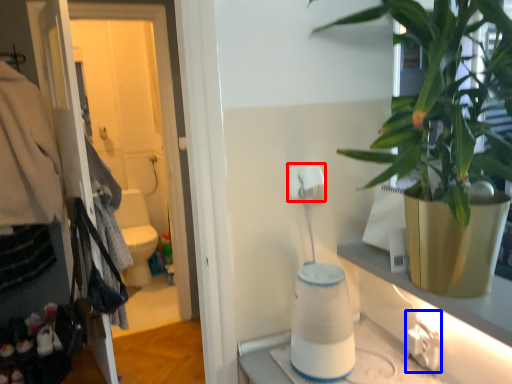
Question: Which object is closer to the camera taking this photo, toilet paper (highlighted by a red box) or electric outlet (highlighted by a blue box)?

Choices:
 (A) toilet paper
 (B) electric outlet

Answer: (B)